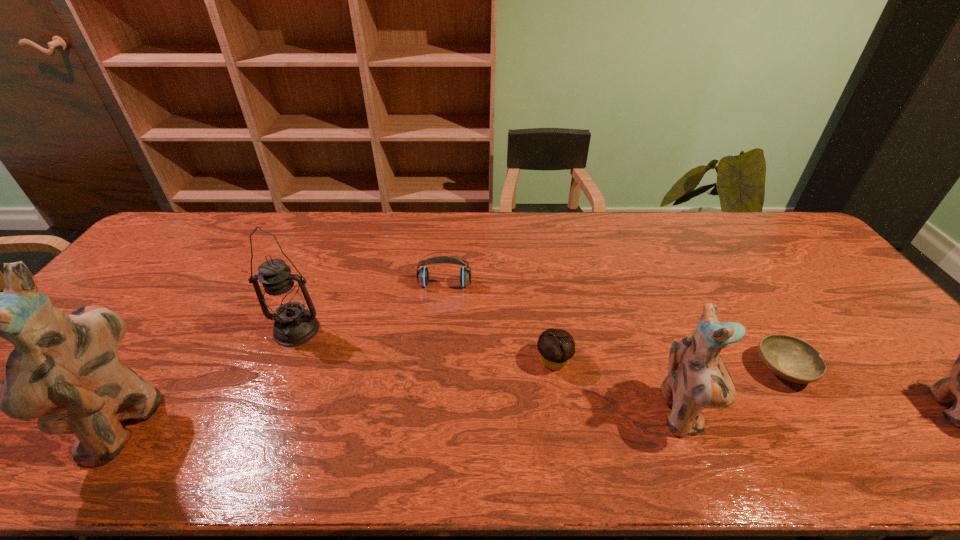
The width and height of the screenshot is (960, 540). I want to click on vacant space at the near edge of the desktop, so click(301, 405).

This screenshot has height=540, width=960. Find the location of `free space at the right edge`. free space at the right edge is located at coordinates (796, 261).

You are a GUI agent. You are given a task and a screenshot of the screen. Output one action in this format:
    pyautogui.click(x=<x>, y=<y>)
    Task: Click on the vacant space at the far left corner of the desktop
    The width and height of the screenshot is (960, 540).
    Given the screenshot: What is the action you would take?
    pyautogui.click(x=192, y=218)

Identify the location of free space between the fifth object from left to right and the leftmost figurine. This screenshot has width=960, height=540. (402, 419).

At what (x,y) coordinates should I click in order to perform the action: click on free area in between the fourth object from right to left and the leftmost figurine. Please return your answer as a coordinate pair (x, y). The width and height of the screenshot is (960, 540). Looking at the image, I should click on (339, 393).

Identify which object is the sixth closest to the headset. Please provide its 2D coordinates. Your answer should be formatted as a tuple, i.e. [(x, y)], where the tuple contains the x and y coordinates of a point satisfying the conditions above.

[(959, 389)]

Where is `object that stands as the fourth closest to the second object from right to left`? The width and height of the screenshot is (960, 540). object that stands as the fourth closest to the second object from right to left is located at coordinates (423, 275).

Identify the location of the closest figurine to the oil lamp. The image size is (960, 540). (65, 370).

This screenshot has width=960, height=540. What are the coordinates of `figurine that stands as the second closest to the leftmost figurine` in the screenshot? It's located at (959, 389).

Find the location of a particular element. The height and width of the screenshot is (540, 960). vacant area that satisfies the following two spatial constraints: 1. on the front side of the second object from left to right; 2. on the front-facing side of the leftmost object is located at coordinates (257, 423).